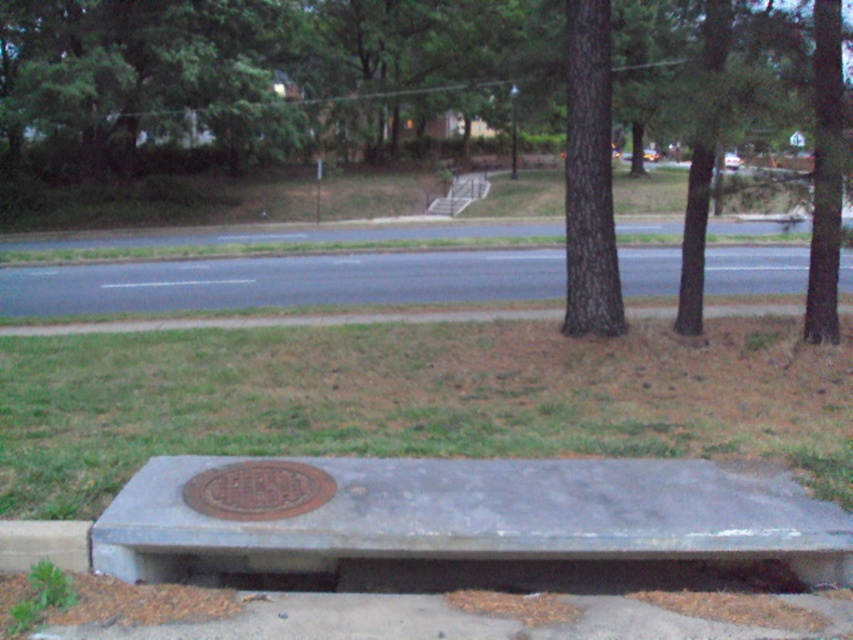
You are standing in the middle of the road and see two trees labeled as brown textured tree at center and brown rough bark tree at center. Which tree would appear larger in your view?

The brown textured tree at center is closer to the viewer than brown rough bark tree at center, so it would appear larger in your view.